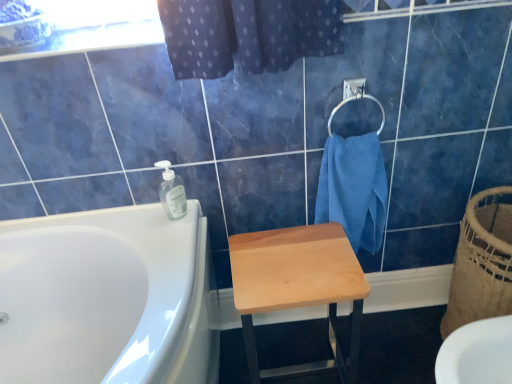
Question: Looking at their shapes, would you say transparent glass window screen at upper left is wider or thinner than silver metallic towel bar at upper right?

Choices:
 (A) thin
 (B) wide

Answer: (B)

Question: Considering the positions of transparent glass window screen at upper left and silver metallic towel bar at upper right in the image, is transparent glass window screen at upper left taller or shorter than silver metallic towel bar at upper right?

Choices:
 (A) tall
 (B) short

Answer: (B)

Question: Which is nearer to the silver metallic towel bar at upper right?

Choices:
 (A) natural woven basket at right
 (B) blue cotton towel at upper right
 (C) clear plastic soap dispenser at upper center
 (D) natural wood stool at center
 (E) transparent glass window screen at upper left

Answer: (B)

Question: Which object is positioned farthest from the blue cotton towel at upper right?

Choices:
 (A) silver metallic towel bar at upper right
 (B) natural wood stool at center
 (C) clear plastic soap dispenser at upper center
 (D) natural woven basket at right
 (E) transparent glass window screen at upper left

Answer: (E)